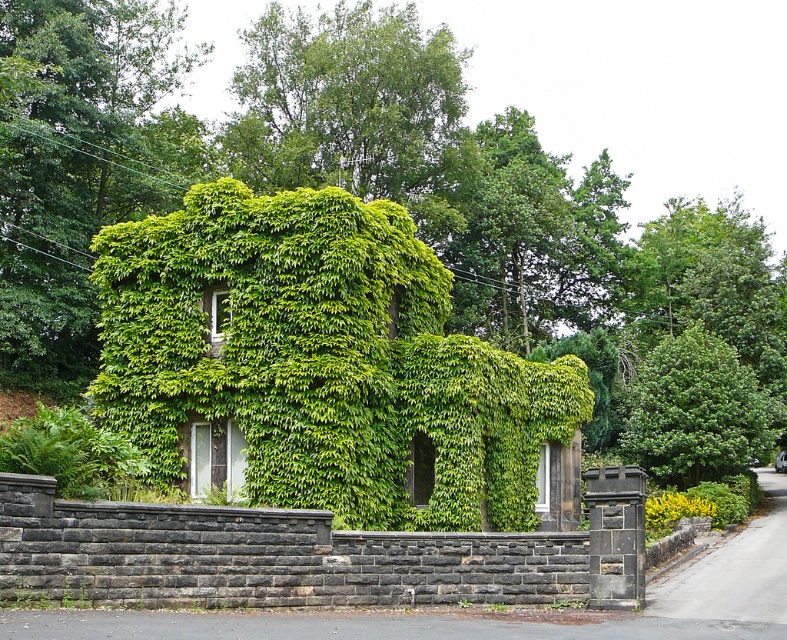
Question: Does green leafy ivy at upper left appear over green leafy tree at right?

Choices:
 (A) yes
 (B) no

Answer: (A)

Question: Is green leafy ivy at upper left to the left of green leafy tree at right from the viewer's perspective?

Choices:
 (A) yes
 (B) no

Answer: (A)

Question: Is green leafy ivy at upper left further to camera compared to green leafy tree at right?

Choices:
 (A) yes
 (B) no

Answer: (B)

Question: Among these points, which one is nearest to the camera?

Choices:
 (A) (215, 161)
 (B) (747, 368)

Answer: (B)